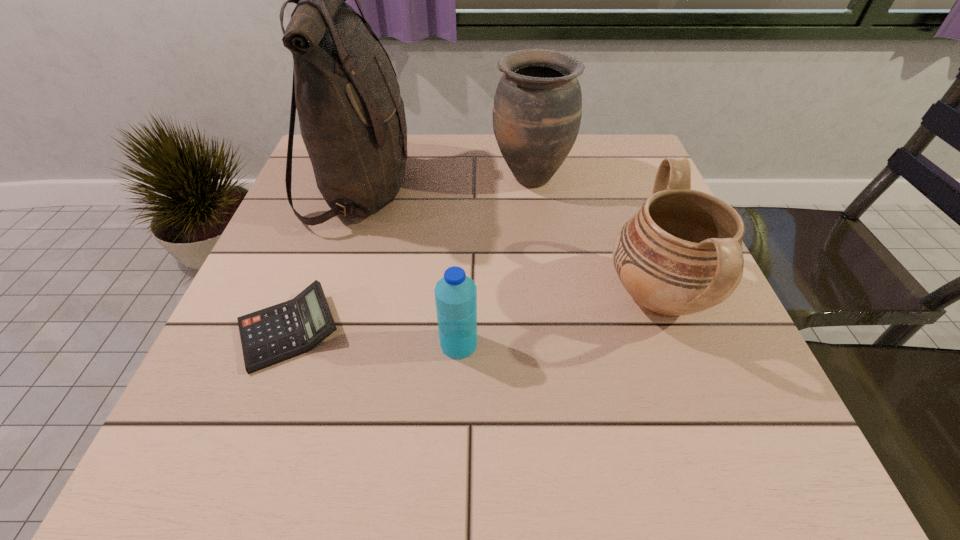
This screenshot has width=960, height=540. In order to click on object positioned at the far left corner in this screenshot , I will do `click(352, 119)`.

This screenshot has height=540, width=960. I want to click on vacant region at the far edge, so click(x=420, y=135).

Locate an element on the screen. This screenshot has height=540, width=960. free spot at the near edge of the desktop is located at coordinates (444, 474).

Locate an element on the screen. The image size is (960, 540). vacant region at the left edge of the desktop is located at coordinates (287, 264).

The width and height of the screenshot is (960, 540). In order to click on free space at the right edge of the desktop in this screenshot , I will do `click(729, 335)`.

The image size is (960, 540). Find the location of `vacant area that lies between the left urn and the third object from left to right`. vacant area that lies between the left urn and the third object from left to right is located at coordinates (494, 261).

This screenshot has height=540, width=960. Find the location of `free space between the third object from left to right and the backpack`. free space between the third object from left to right and the backpack is located at coordinates (410, 267).

Find the location of a particular element. The width and height of the screenshot is (960, 540). unoccupied area between the third object from left to right and the shortest object is located at coordinates [374, 338].

Where is `empty location between the shortest object and the fourth object from left to right`? The image size is (960, 540). empty location between the shortest object and the fourth object from left to right is located at coordinates (410, 254).

The image size is (960, 540). Identify the location of free space between the backpack and the water bottle. (x=410, y=267).